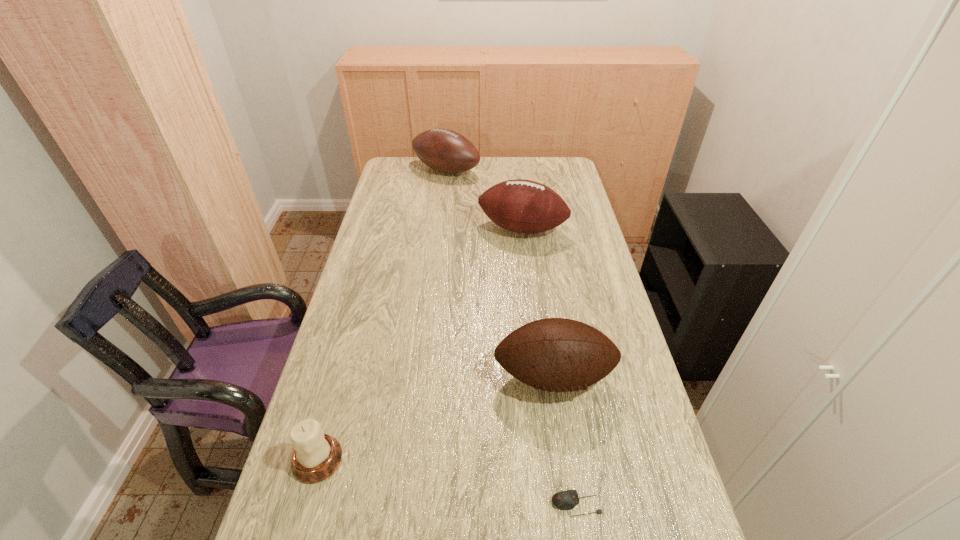
At what (x,y) coordinates should I click in order to perform the action: click on the fourth nearest object. Please return your answer as a coordinate pair (x, y). This screenshot has width=960, height=540. Looking at the image, I should click on (523, 206).

Find the location of a particular element. The width and height of the screenshot is (960, 540). the farthest football is located at coordinates pyautogui.click(x=446, y=151).

Find the location of `the third nearest object`. the third nearest object is located at coordinates (553, 354).

Locate an element on the screen. the leftmost object is located at coordinates click(x=316, y=456).

Locate an element on the screen. The image size is (960, 540). the fourth tallest object is located at coordinates (316, 456).

The width and height of the screenshot is (960, 540). I want to click on the nearest object, so click(x=565, y=500).

At what (x,y) coordinates should I click in order to perform the action: click on mouse. Please return your answer as a coordinate pair (x, y). The height and width of the screenshot is (540, 960). Looking at the image, I should click on (565, 500).

This screenshot has height=540, width=960. Find the location of `vacant position located 0.140m on the front of the fourth nearest object`. vacant position located 0.140m on the front of the fourth nearest object is located at coordinates [527, 271].

The width and height of the screenshot is (960, 540). I want to click on vacant space located on the left of the farthest object, so click(x=388, y=170).

The width and height of the screenshot is (960, 540). In order to click on vacant region located 0.290m on the laces of the third farthest object in this screenshot , I will do `click(577, 536)`.